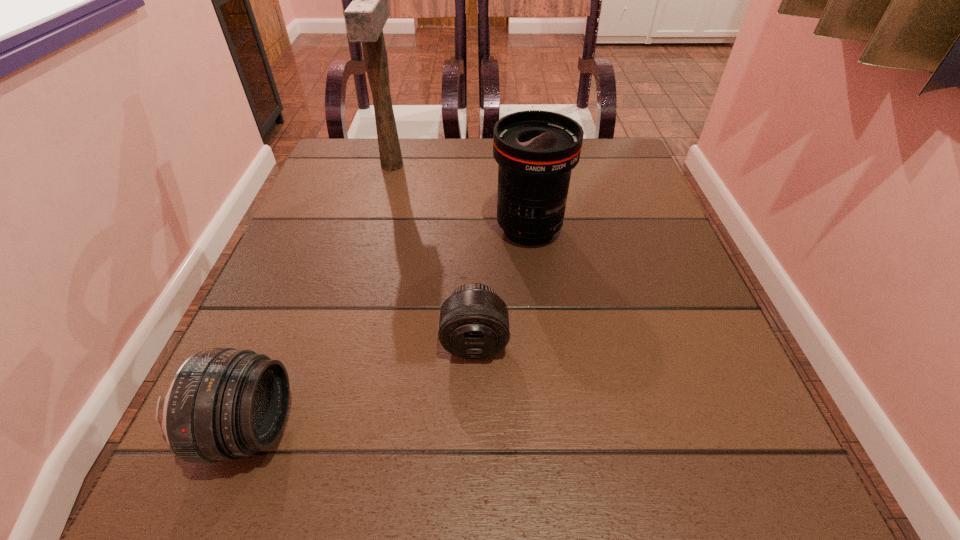
The height and width of the screenshot is (540, 960). In order to click on free space located 0.220m at the front element of the nearest object in this screenshot , I will do (448, 429).

Identify the location of free location located 0.210m on the front-facing side of the shortest object. The height and width of the screenshot is (540, 960). (472, 514).

In order to click on object that is at the far edge in this screenshot , I will do [x=365, y=17].

Locate an element on the screen. Image resolution: width=960 pixels, height=540 pixels. object positioned at the near edge is located at coordinates (223, 403).

Where is `mallet at the left edge`? mallet at the left edge is located at coordinates (365, 17).

The image size is (960, 540). I want to click on telephoto lens situated at the left edge, so click(223, 403).

Where is `object at the far left corner`? object at the far left corner is located at coordinates (365, 17).

Find the location of a particular element. object that is at the near left corner is located at coordinates (223, 403).

Where is `vacant space at the far edge`? The width and height of the screenshot is (960, 540). vacant space at the far edge is located at coordinates (418, 188).

What are the coordinates of `vacant space at the left edge of the desktop` in the screenshot? It's located at (337, 281).